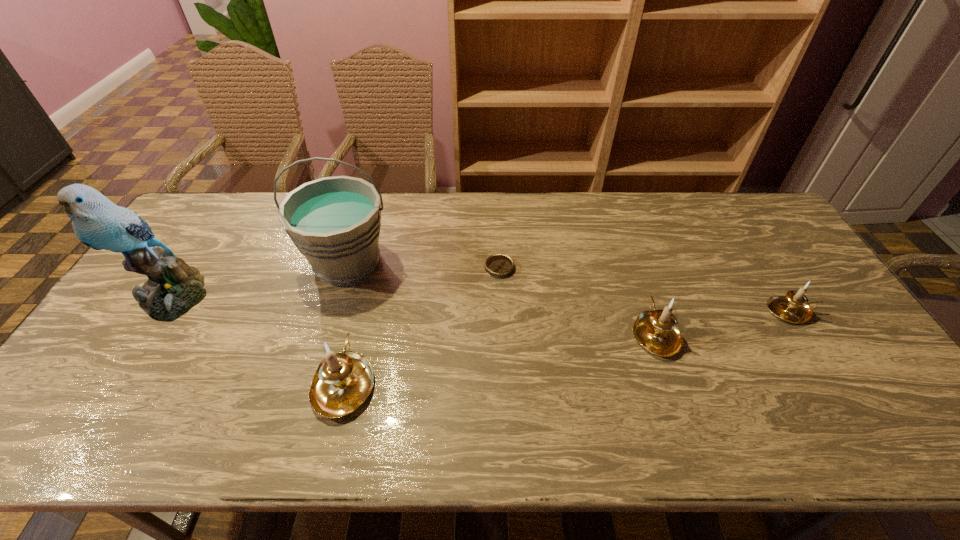
At what (x,y) coordinates should I click in order to perform the action: click on empty space that is in between the second shortest object and the bucket. Please return your answer as a coordinate pair (x, y). The height and width of the screenshot is (540, 960). Looking at the image, I should click on pyautogui.click(x=569, y=287).

This screenshot has height=540, width=960. I want to click on empty location between the rightmost object and the parakeet, so click(482, 303).

I want to click on free space between the leftmost object and the second tallest candle holder, so click(414, 314).

Find the location of `free space between the bucket and the leftmost object`. free space between the bucket and the leftmost object is located at coordinates (260, 279).

Find the location of `free space between the second object from right to left and the third tallest object`. free space between the second object from right to left and the third tallest object is located at coordinates (500, 357).

Where is `vacant region between the rightmost candle holder and the parakeet`? The height and width of the screenshot is (540, 960). vacant region between the rightmost candle holder and the parakeet is located at coordinates (482, 303).

The width and height of the screenshot is (960, 540). I want to click on vacant space in between the leftmost candle holder and the compass, so click(x=421, y=325).

Where is `free spot between the leftmost object and the third shortest object`? Image resolution: width=960 pixels, height=540 pixels. free spot between the leftmost object and the third shortest object is located at coordinates (414, 314).

The width and height of the screenshot is (960, 540). Find the location of `free space between the shortest object and the bucket`. free space between the shortest object and the bucket is located at coordinates (423, 265).

Identify the location of free spot between the second shortest candle holder and the leftmost candle holder. (500, 357).